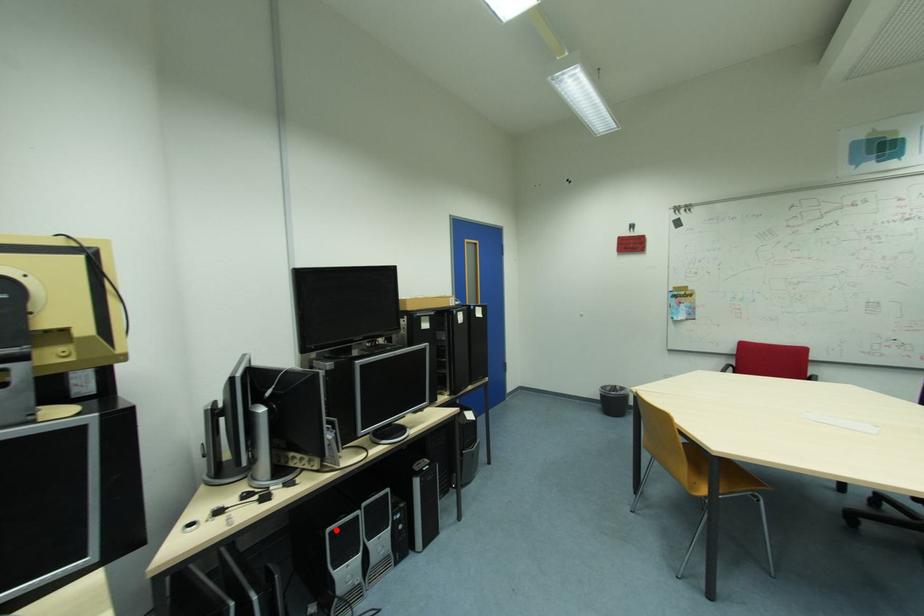
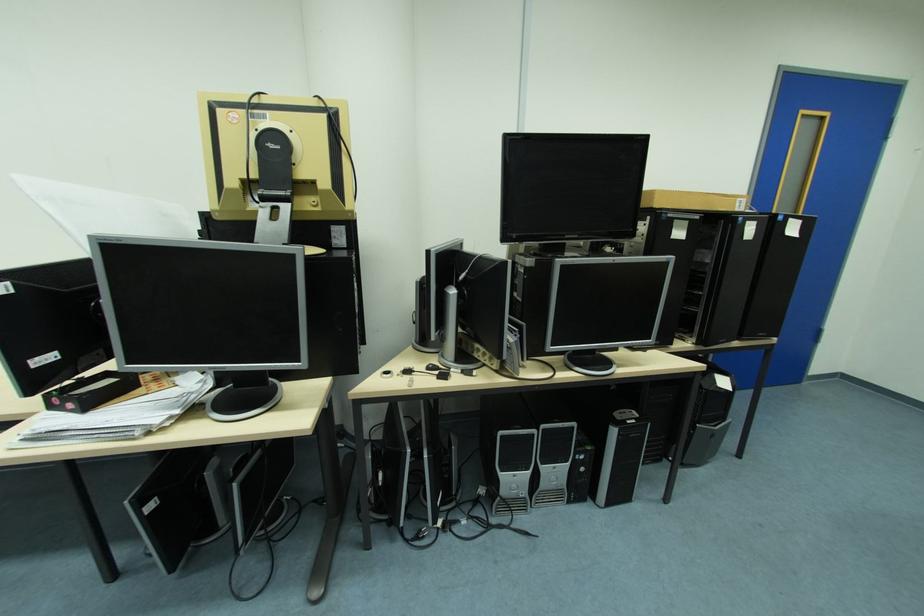
The point at the highlighted location is marked in the first image. Where is the corresponding point in the second image?

(507, 434)